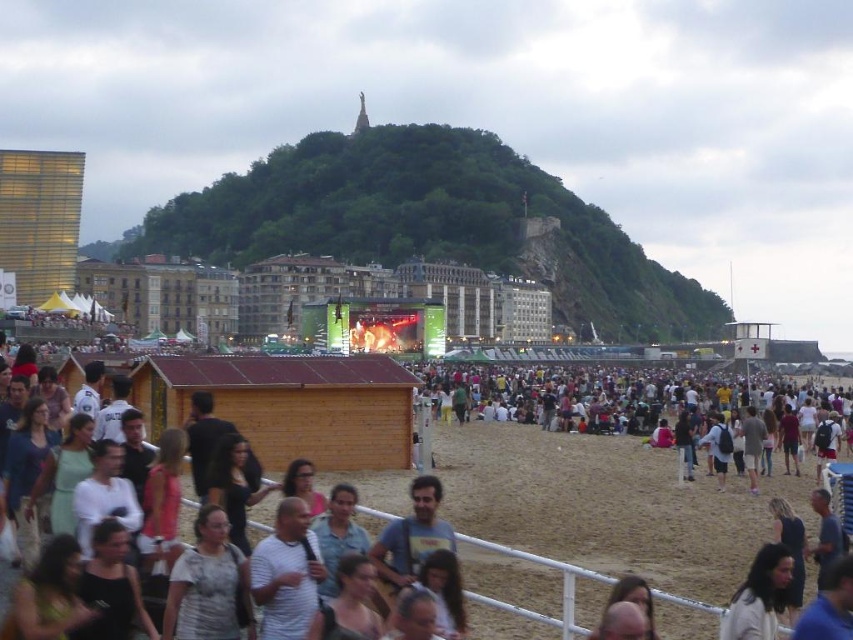
Based on the photo, you are a photographer trying to capture a photo of the light brown hair at lower right and the dark brown sand at center. Which object should you focus on first if you want to ensure both are in the frame without moving the camera?

The dark brown sand at center is much taller than the light brown hair at lower right, so you should focus on the dark brown sand at center first to ensure both are in the frame without moving the camera.

You are a photographer at the beach event and want to capture both the wooden hut at center and the light brown hair at lower right in a single frame. Which object should you focus on first to ensure both are in the frame?

You should focus on the wooden hut at center first because it is larger and will require more space in the frame compared to the light brown hair at lower right.